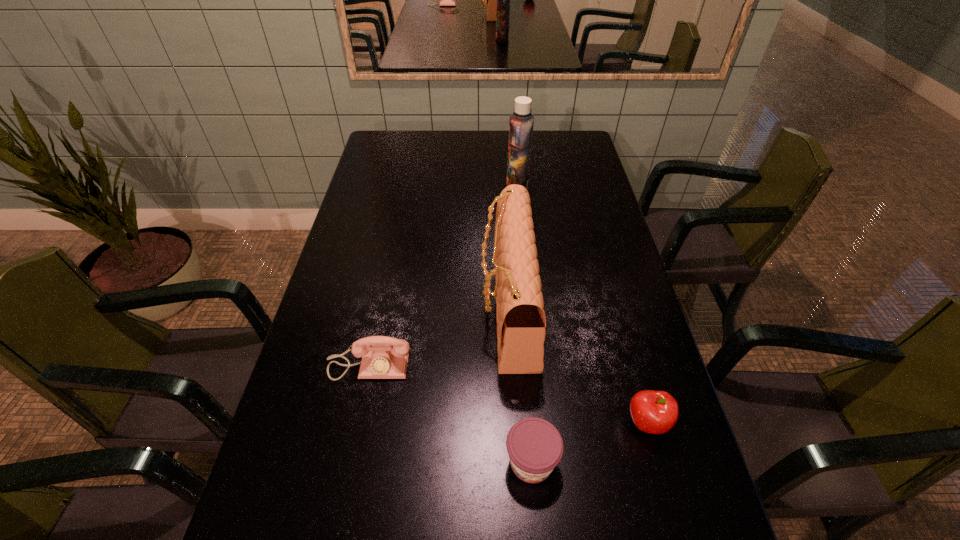
Identify the location of free point that satisfies the following two spatial constraints: 1. on the front label of the tallest object; 2. on the front label of the shortest object. The image size is (960, 540). point(544,461).

Locate an element on the screen. The width and height of the screenshot is (960, 540). free spot that satisfies the following two spatial constraints: 1. on the front-facing side of the handbag; 2. on the left side of the apple is located at coordinates (515, 423).

The image size is (960, 540). Identify the location of vacant area that satisfies the following two spatial constraints: 1. on the front-facing side of the handbag; 2. on the dial of the leftmost object. (512, 364).